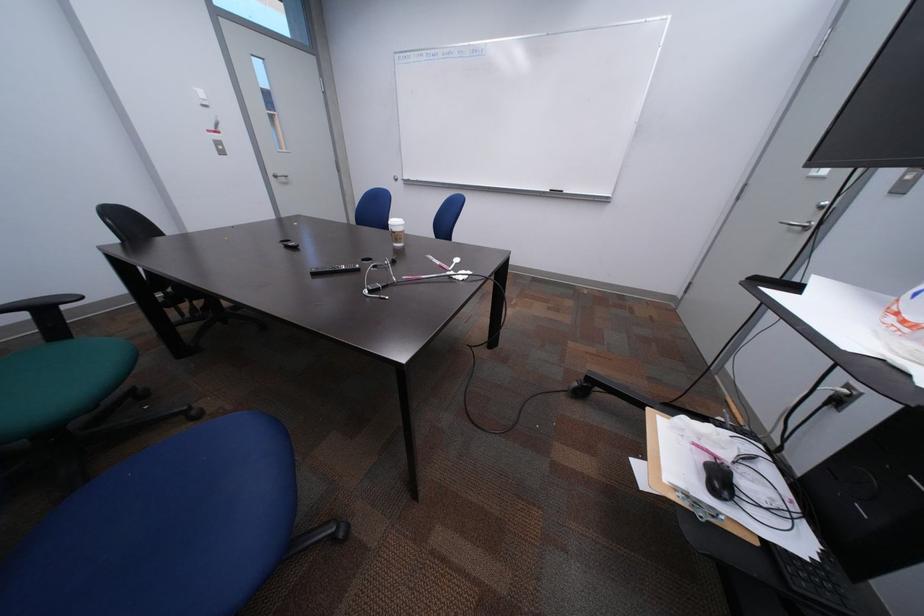
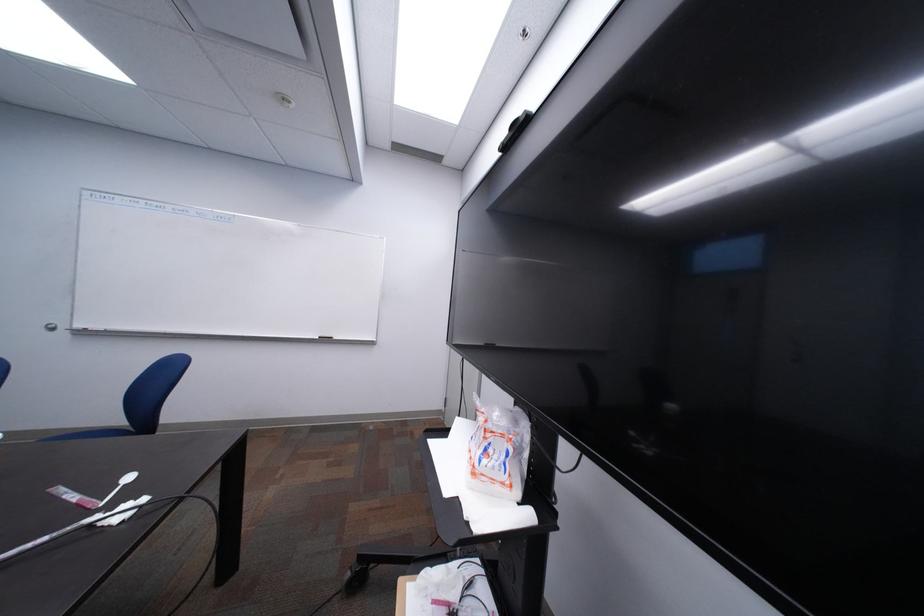
The images are taken continuously from a first-person perspective. In which direction is your viewpoint rotating?

The camera rotated toward right-up.